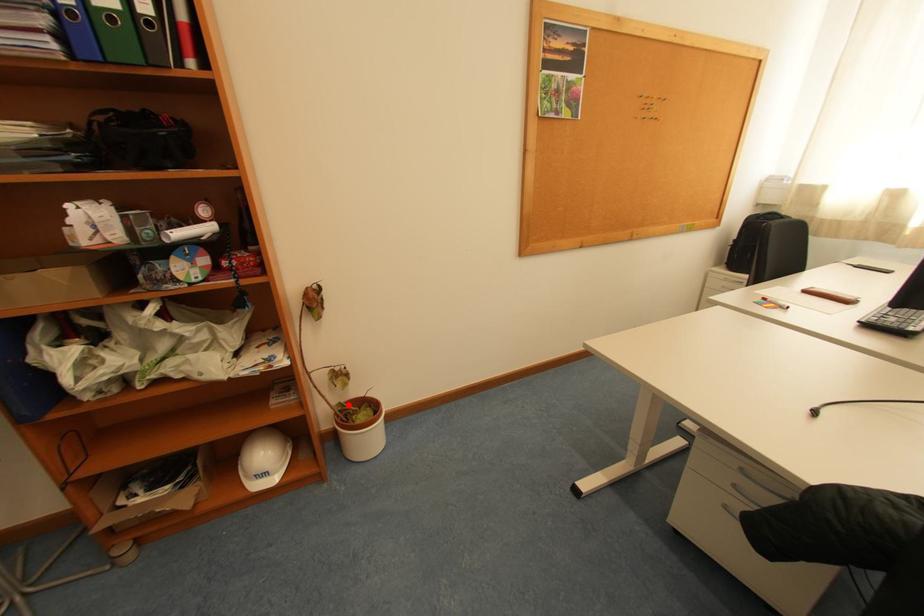
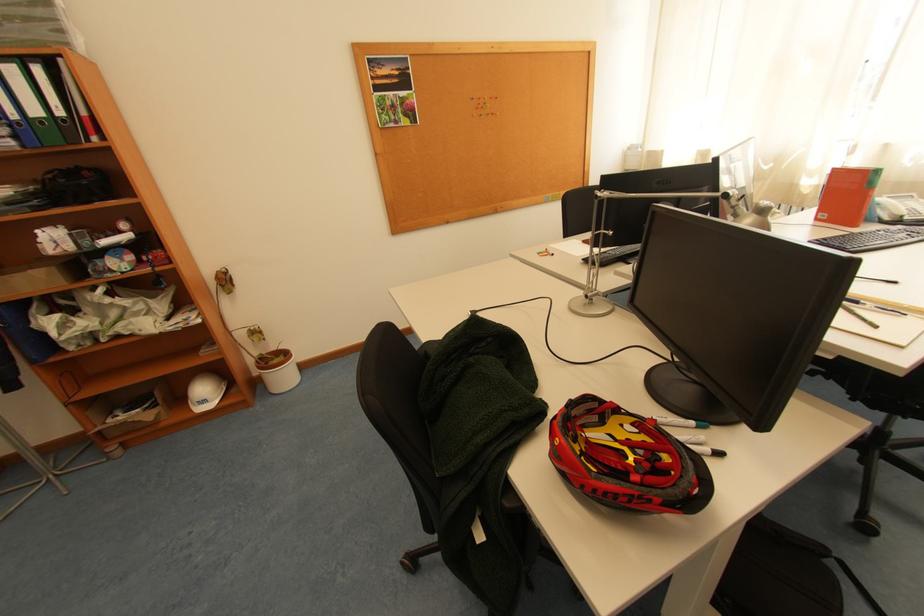
Question: I am providing you with two images of the same scene from different viewpoints. In image1, a red point is highlighted. Considering the same 3D point in image2, which of the following is correct?

Choices:
 (A) It is closer
 (B) It is farther

Answer: (A)